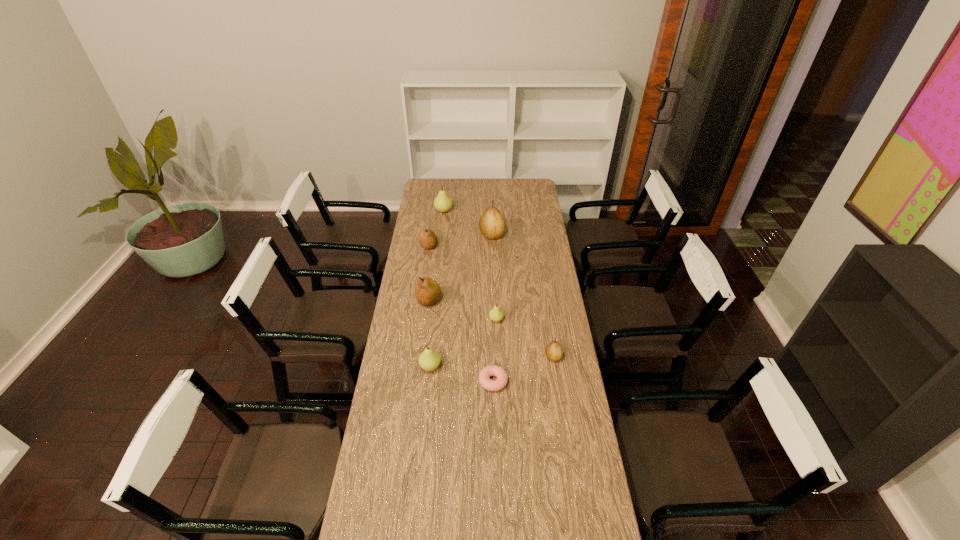
Find the location of a particular element. This screenshot has width=960, height=540. the rightmost brown pear is located at coordinates (554, 352).

This screenshot has height=540, width=960. Identify the location of the rightmost object. (554, 352).

Locate an element on the screen. The image size is (960, 540). pink doughnut is located at coordinates (492, 370).

Find the location of a particular element. This screenshot has height=540, width=960. the shortest object is located at coordinates (492, 370).

Identify the location of vacant region located on the left of the tallest pear. (448, 235).

At what (x,y) coordinates should I click in order to perform the action: click on vacant region located on the right of the biggest green pear. Please return your answer as a coordinate pair (x, y). The width and height of the screenshot is (960, 540). Looking at the image, I should click on (465, 211).

Where is `free space located 0.190m on the front of the fourth farthest object`? The width and height of the screenshot is (960, 540). free space located 0.190m on the front of the fourth farthest object is located at coordinates (423, 342).

The height and width of the screenshot is (540, 960). Identify the location of vacant space positioned 0.340m on the right of the third biggest brown pear. (501, 246).

Locate an element on the screen. vacant space situated 0.390m on the right of the nearest green pear is located at coordinates (538, 367).

At what (x,y) coordinates should I click in order to perform the action: click on vacant space located 0.260m on the left of the second nearest green pear. Please return your answer as a coordinate pair (x, y). Image resolution: width=960 pixels, height=540 pixels. Looking at the image, I should click on (431, 320).